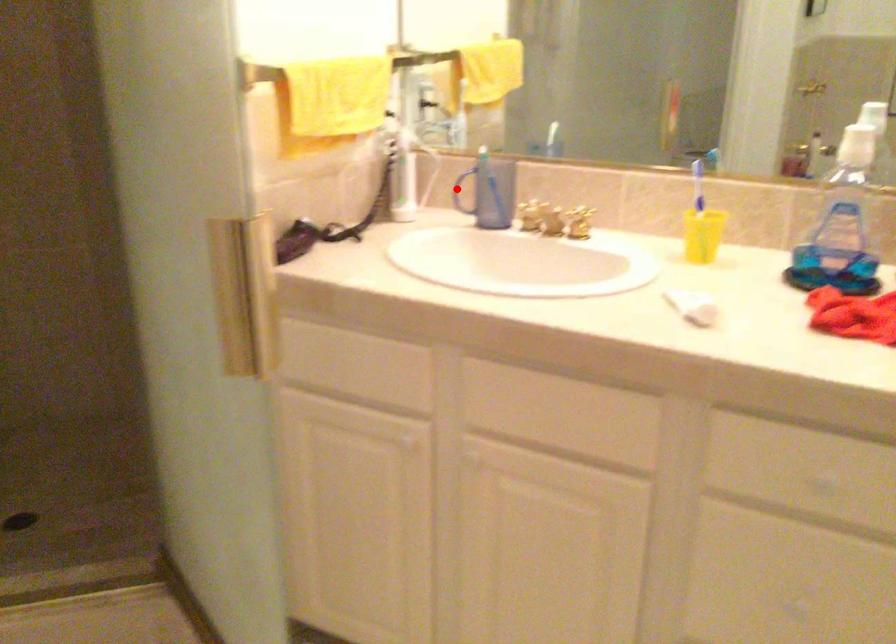
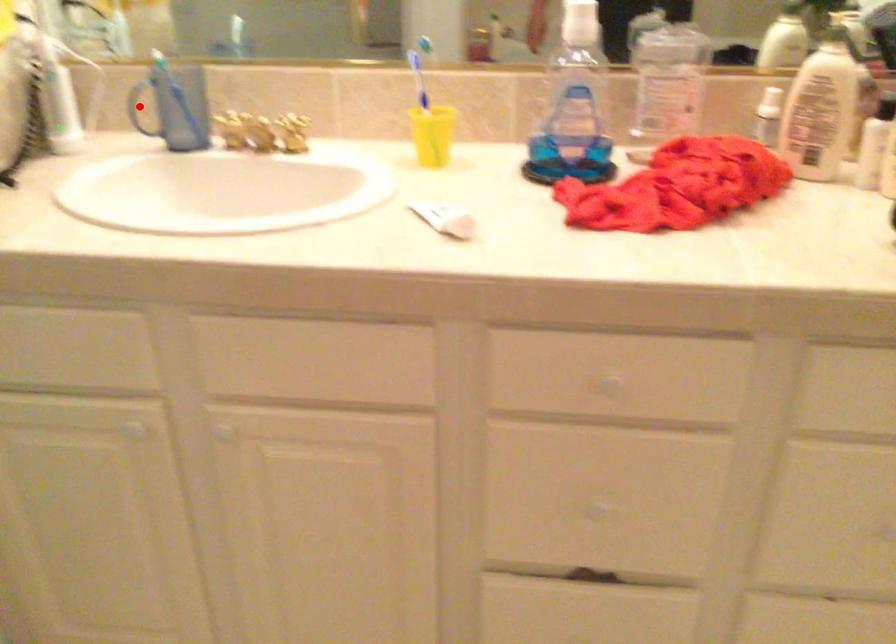
I am providing you with two images of the same scene from different viewpoints. A red point is marked on the first image and another point is marked on the second image. Is the marked point in image1 the same physical position as the marked point in image2?

Yes